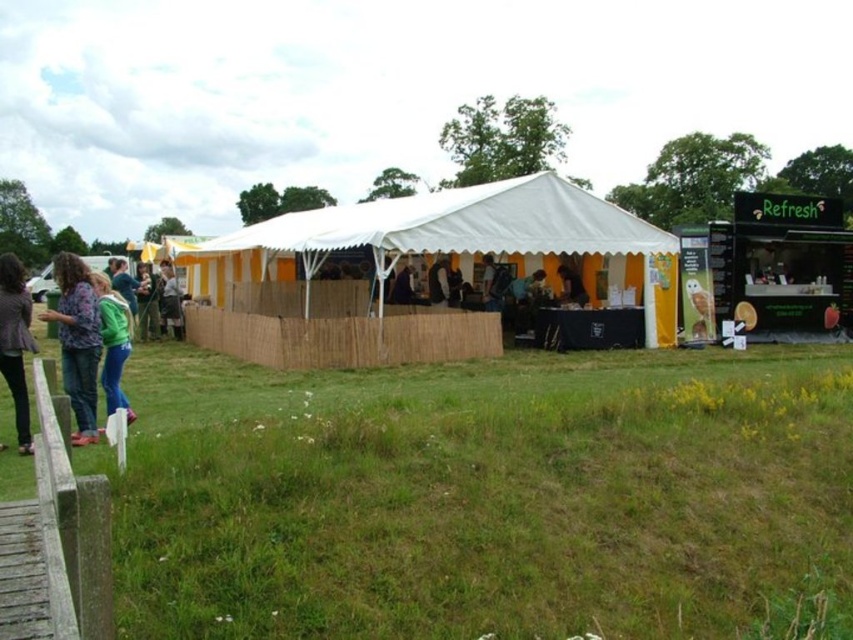
From the picture: Is denim jacket at left thinner than dark gray textured jacket at left?

Incorrect, denim jacket at left's width is not less than dark gray textured jacket at left's.

Which is more to the right, denim jacket at left or dark gray textured jacket at left?

→ dark gray textured jacket at left

Between point (88, 365) and point (3, 269), which one is positioned behind?

Positioned behind is point (88, 365).

Find the location of a particular element. denim jacket at left is located at coordinates (77, 340).

Is dark gray textured jacket at left wider than matte yellow shirt at center?

Indeed, dark gray textured jacket at left has a greater width compared to matte yellow shirt at center.

Locate an element on the screen. This screenshot has width=853, height=640. dark gray textured jacket at left is located at coordinates (15, 340).

Image resolution: width=853 pixels, height=640 pixels. In order to click on dark gray textured jacket at left in this screenshot , I will do `click(15, 340)`.

Locate an element on the screen. The height and width of the screenshot is (640, 853). dark gray textured jacket at left is located at coordinates (15, 340).

Is point (3, 284) positioned in front of point (103, 284)?

Yes, point (3, 284) is in front of point (103, 284).

This screenshot has width=853, height=640. What are the coordinates of `dark gray textured jacket at left` in the screenshot? It's located at (15, 340).